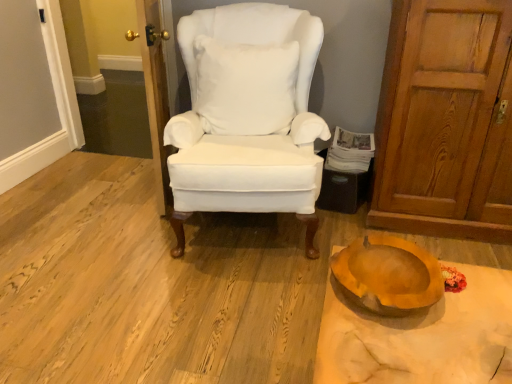
Find the location of a particular element. The width and height of the screenshot is (512, 384). free spot below matte orange bowl at lower right (from a real-world perspective) is located at coordinates [394, 280].